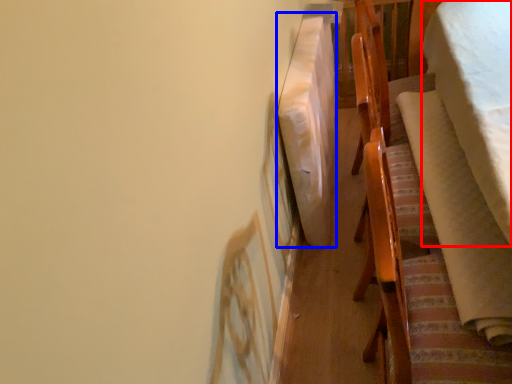
Question: Which object appears farthest to the camera in this image, blanket (highlighted by a red box) or blanket (highlighted by a blue box)?

Choices:
 (A) blanket
 (B) blanket

Answer: (B)